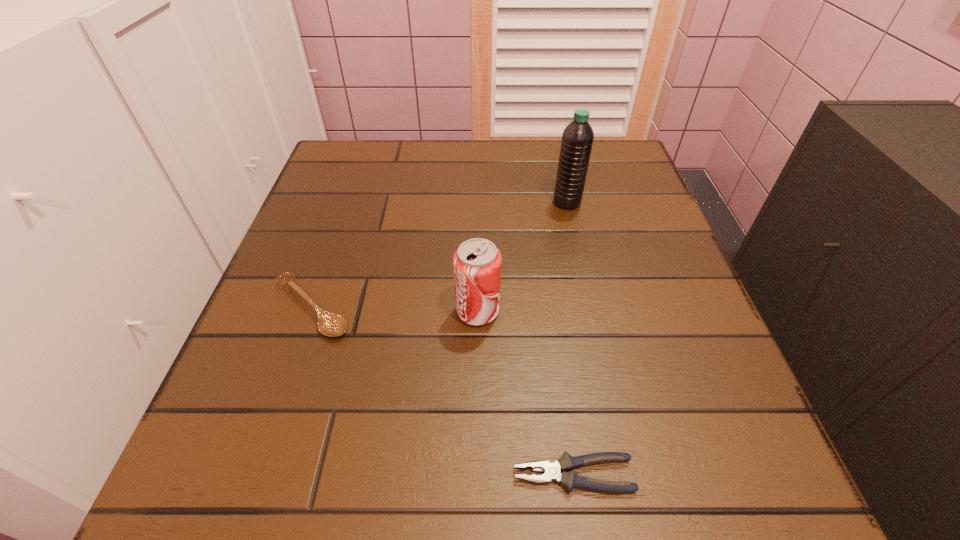
Where is `empty space that is in between the tallest object and the shortest object`? This screenshot has height=540, width=960. empty space that is in between the tallest object and the shortest object is located at coordinates tap(570, 339).

You are a GUI agent. You are given a task and a screenshot of the screen. Output one action in this format:
    pyautogui.click(x=<x>, y=<y>)
    Task: Click on the free space that is in between the ladle and the soda can
    The image size is (960, 540).
    Given the screenshot: What is the action you would take?
    pyautogui.click(x=395, y=309)

You are a GUI agent. You are given a task and a screenshot of the screen. Output one action in this format:
    pyautogui.click(x=<x>, y=<y>)
    Task: Click on the free spot between the leftmost object and the third object from right to left
    The image size is (960, 540).
    Given the screenshot: What is the action you would take?
    pyautogui.click(x=395, y=309)

Where is `vacant area that lies between the second shortest object and the pliers`? vacant area that lies between the second shortest object and the pliers is located at coordinates (443, 391).

Identify the location of vacant point located between the tallest object and the leftmost object. (440, 255).

Image resolution: width=960 pixels, height=540 pixels. What are the coordinates of `object that is the nearest to the second object from left to right` in the screenshot? It's located at (330, 324).

In order to click on object that is the third closest one to the nearest object in this screenshot , I will do `click(577, 139)`.

At what (x,y) coordinates should I click in order to perform the action: click on vacant region that satisfies the following two spatial constraints: 1. on the back side of the third object from right to left; 2. on the right side of the farthest object. Please return your answer as a coordinate pair (x, y). Looking at the image, I should click on (478, 202).

The image size is (960, 540). What are the coordinates of `free location that satisfies the following two spatial constraints: 1. on the front side of the ladle; 2. on the left side of the soda can` in the screenshot? It's located at (310, 311).

You are a GUI agent. You are given a task and a screenshot of the screen. Output one action in this format:
    pyautogui.click(x=<x>, y=<y>)
    Task: Click on the free region that satisfies the following two spatial constraints: 1. on the back side of the third object from right to left; 2. on the left side of the water bottle
    The image size is (960, 540).
    Given the screenshot: What is the action you would take?
    pyautogui.click(x=478, y=202)